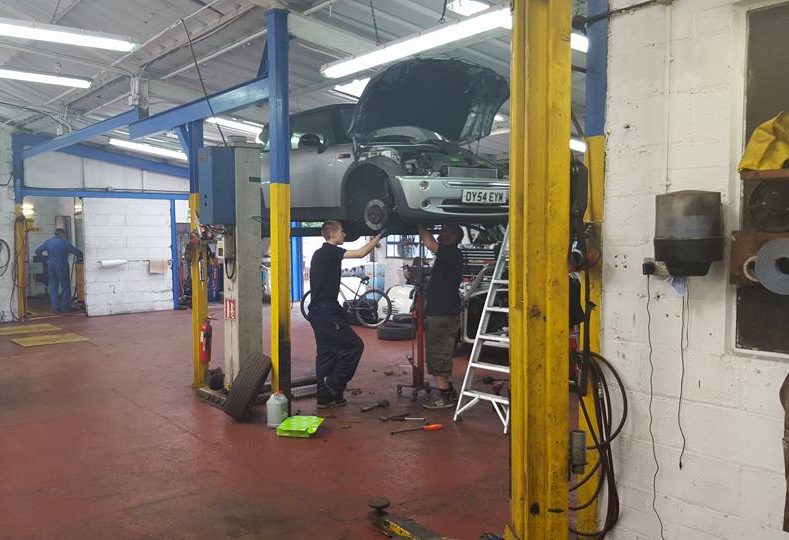
Locate an element on the screen. red floor is located at coordinates (234, 443).